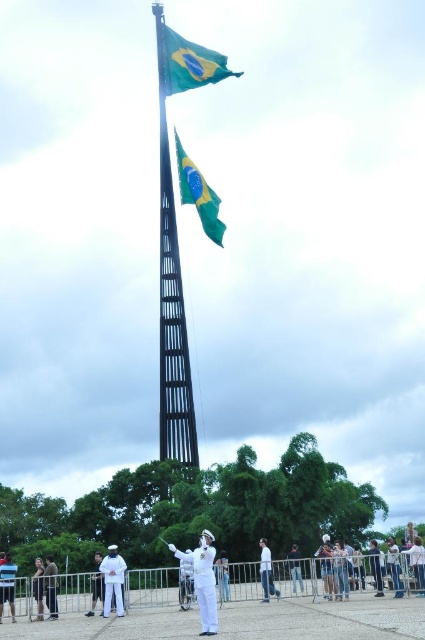
Between black metal/mesh mast at upper center and white uniform at lower center, which one is positioned lower?

white uniform at lower center is lower down.

Does point (169, 404) come behind point (121, 572)?

That is True.

At what (x,y) coordinates should I click in order to perform the action: click on black metal/mesh mast at upper center. Please return your answer as a coordinate pair (x, y). The height and width of the screenshot is (640, 425). Looking at the image, I should click on (172, 304).

Is white matte uniform at center further to the viewer compared to white uniform at lower center?

That is False.

Who is shorter, white matte uniform at center or white uniform at lower center?

Standing shorter between the two is white uniform at lower center.

What do you see at coordinates (203, 579) in the screenshot? The height and width of the screenshot is (640, 425). I see `white matte uniform at center` at bounding box center [203, 579].

Find the location of a particular element. Image resolution: width=425 pixels, height=640 pixels. white matte uniform at center is located at coordinates (203, 579).

Is green and yellow fabric flag at upper center shorter than white matte uniform at center?

Incorrect, green and yellow fabric flag at upper center's height does not fall short of white matte uniform at center's.

This screenshot has height=640, width=425. In order to click on green and yellow fabric flag at upper center in this screenshot , I will do `click(198, 195)`.

This screenshot has height=640, width=425. Identify the location of green and yellow fabric flag at upper center. (198, 195).